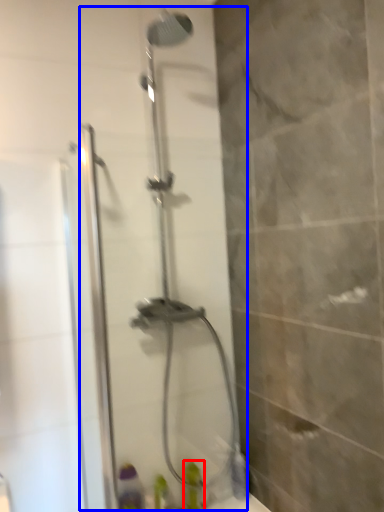
Question: Which object appears closest to the camera in this image, toiletry (highlighted by a red box) or shower door (highlighted by a blue box)?

Choices:
 (A) toiletry
 (B) shower door

Answer: (B)